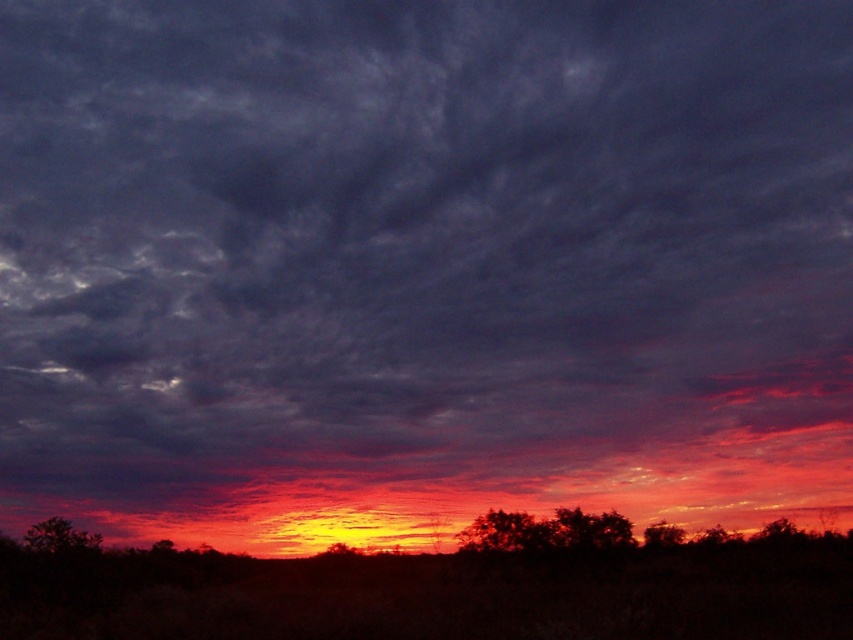
Does silhouette tree at center have a larger size compared to silhouette tree at lower right?

Indeed, silhouette tree at center has a larger size compared to silhouette tree at lower right.

The image size is (853, 640). Describe the element at coordinates (505, 532) in the screenshot. I see `silhouette tree at center` at that location.

Between point (514, 532) and point (668, 538), which one is positioned behind?

The point (668, 538) is more distant.

At what (x,y) coordinates should I click in order to perform the action: click on silhouette tree at center. Please return your answer as a coordinate pair (x, y). The height and width of the screenshot is (640, 853). Looking at the image, I should click on (505, 532).

Who is more forward, (x=523, y=538) or (x=57, y=547)?

Point (x=57, y=547)

Is point (466, 541) closer to camera compared to point (64, 544)?

That is False.

Is point (532, 516) farther from viewer compared to point (32, 536)?

Yes, it is behind point (32, 536).

Locate an element on the screen. Image resolution: width=853 pixels, height=640 pixels. silhouette tree at center is located at coordinates (505, 532).

Is silhouetted tree at lower center wider than silhouette tree at lower right?

Yes.

Measure the distance between point (570, 512) and camera.

A distance of 40.52 meters exists between point (570, 512) and camera.

What do you see at coordinates (590, 529) in the screenshot? I see `silhouetted tree at lower center` at bounding box center [590, 529].

Locate an element on the screen. This screenshot has width=853, height=640. silhouetted tree at lower center is located at coordinates (590, 529).